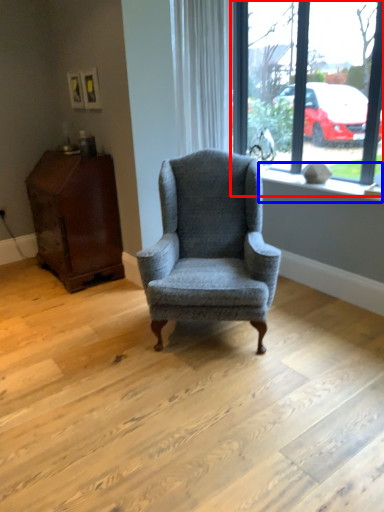
Question: Among these objects, which one is nearest to the camera, window (highlighted by a red box) or window sill (highlighted by a blue box)?

Choices:
 (A) window
 (B) window sill

Answer: (A)